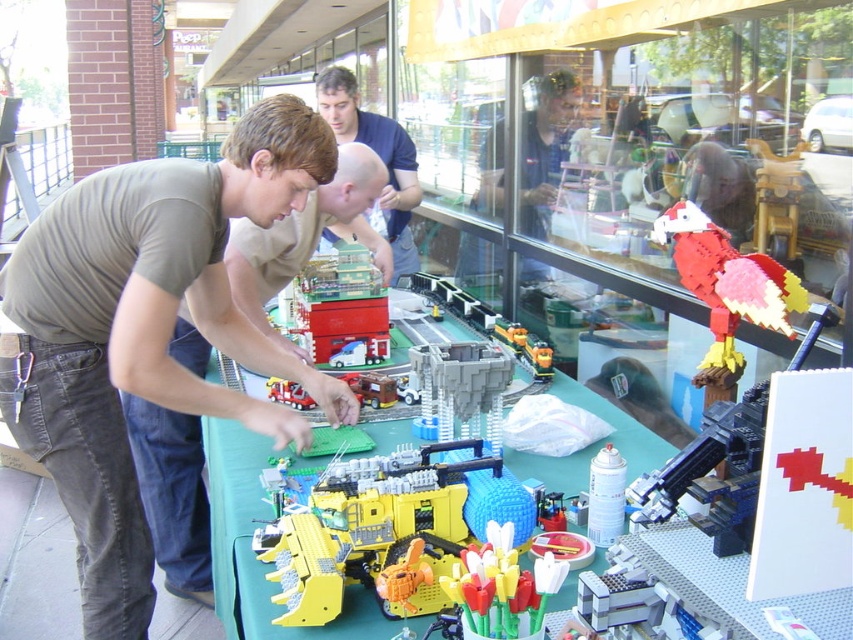
Based on the photo, can you confirm if brick-like parrot at upper right is bigger than brick-like train at center?

No.

Is brick-like parrot at upper right to the left of brick-like train at center from the viewer's perspective?

No, brick-like parrot at upper right is not to the left of brick-like train at center.

Identify the location of brick-like parrot at upper right. The width and height of the screenshot is (853, 640). pos(727,282).

Who is higher up, brick-like plastic tulips at center or red plastic fire truck at center?

Positioned higher is red plastic fire truck at center.

Can you confirm if brick-like plastic tulips at center is thinner than red plastic fire truck at center?

Incorrect, brick-like plastic tulips at center's width is not less than red plastic fire truck at center's.

The width and height of the screenshot is (853, 640). Identify the location of brick-like plastic tulips at center. (502, 588).

At what (x,y) coordinates should I click in order to perform the action: click on brick-like plastic tulips at center. Please return your answer as a coordinate pair (x, y). Looking at the image, I should click on (502, 588).

Is point (306, 356) behind point (543, 340)?

No.

Does point (337, 308) come behind point (525, 349)?

That is True.

Where is `brick red plastic building at center`? This screenshot has height=640, width=853. brick red plastic building at center is located at coordinates (334, 298).